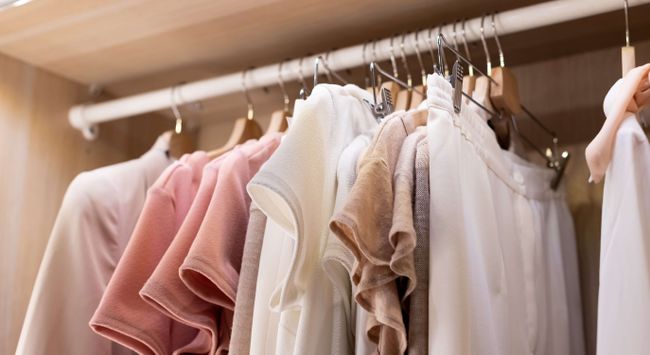
Find the location of a particular element. The height and width of the screenshot is (355, 650). hangers is located at coordinates (183, 143), (246, 129), (275, 118), (396, 101), (410, 98), (626, 55).